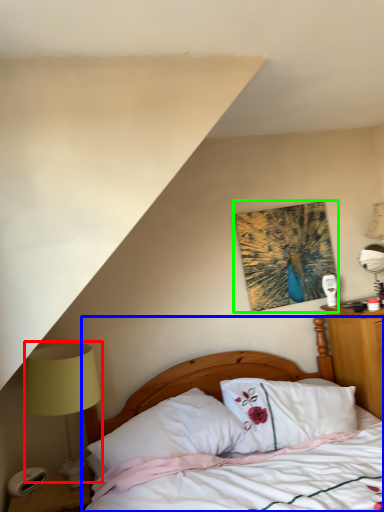
Question: Estimate the real-world distances between objects in this image. Which object is farther from bedside lamp (highlighted by a red box), bed (highlighted by a blue box) or picture frame (highlighted by a green box)?

Choices:
 (A) bed
 (B) picture frame

Answer: (B)